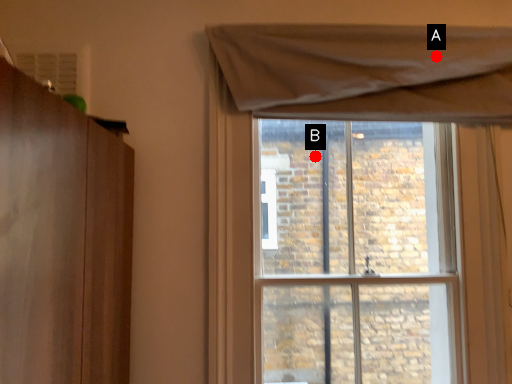
Question: Two points are circled on the image, labeled by A and B beside each circle. Which point appears closest to the camera in this image?

Choices:
 (A) A is closer
 (B) B is closer

Answer: (A)